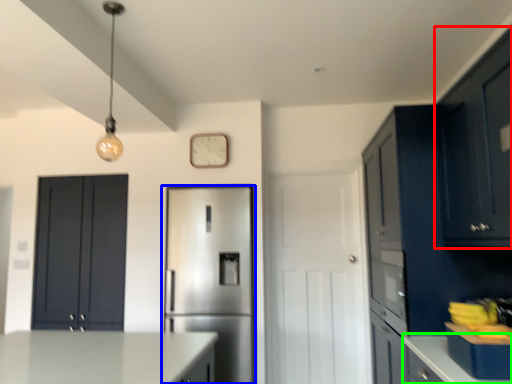
Question: Considering the real-world distances, which object is farthest from cabinetry (highlighted by a red box)? refrigerator (highlighted by a blue box) or counter top (highlighted by a green box)?

Choices:
 (A) refrigerator
 (B) counter top

Answer: (A)